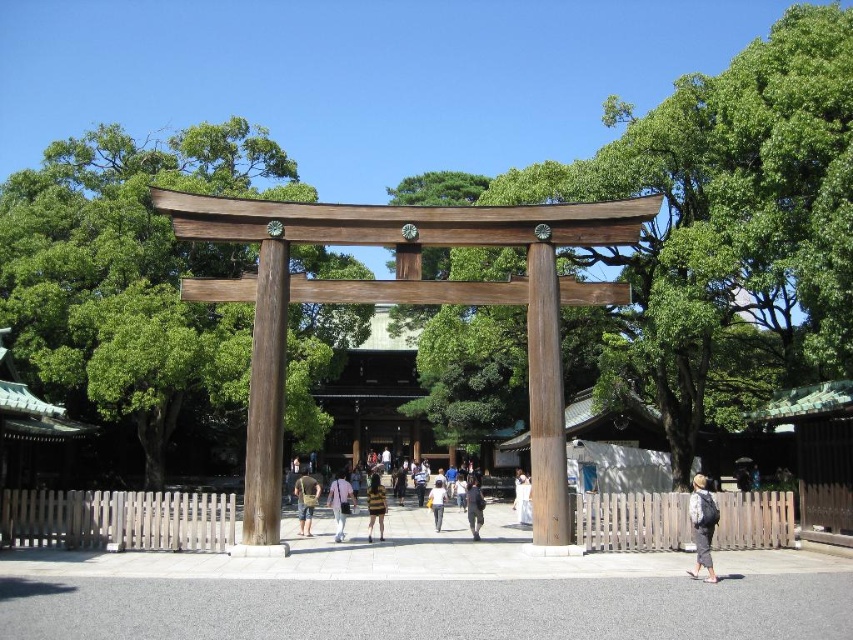
Question: Estimate the real-world distances between objects in this image. Which object is closer to the brown fabric bag at center?

Choices:
 (A) light brown backpack at lower right
 (B) light brown wooden post at center

Answer: (B)

Question: Does dark gray fabric pants at center have a lesser width compared to white cotton shirt at center?

Choices:
 (A) yes
 (B) no

Answer: (B)

Question: Is light brown backpack at lower right to the left of brown fabric bag at center from the viewer's perspective?

Choices:
 (A) no
 (B) yes

Answer: (A)

Question: Can you confirm if brown fabric bag at center is bigger than white cotton shirt at center?

Choices:
 (A) yes
 (B) no

Answer: (A)

Question: Among these points, which one is nearest to the camera?

Choices:
 (A) (300, 516)
 (B) (471, 518)
 (C) (701, 525)
 (D) (338, 508)

Answer: (C)

Question: Estimate the real-world distances between objects in this image. Which object is closer to the dark gray fabric pants at center?

Choices:
 (A) white cotton shirt at center
 (B) light brown wooden post at center
 (C) light brown backpack at lower right
 (D) striped fabric shirt at center

Answer: (A)